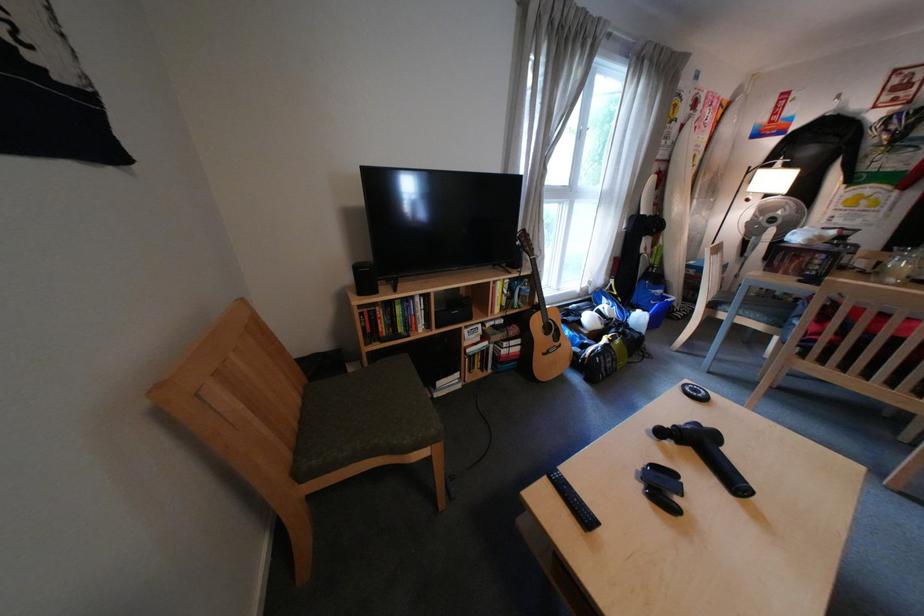
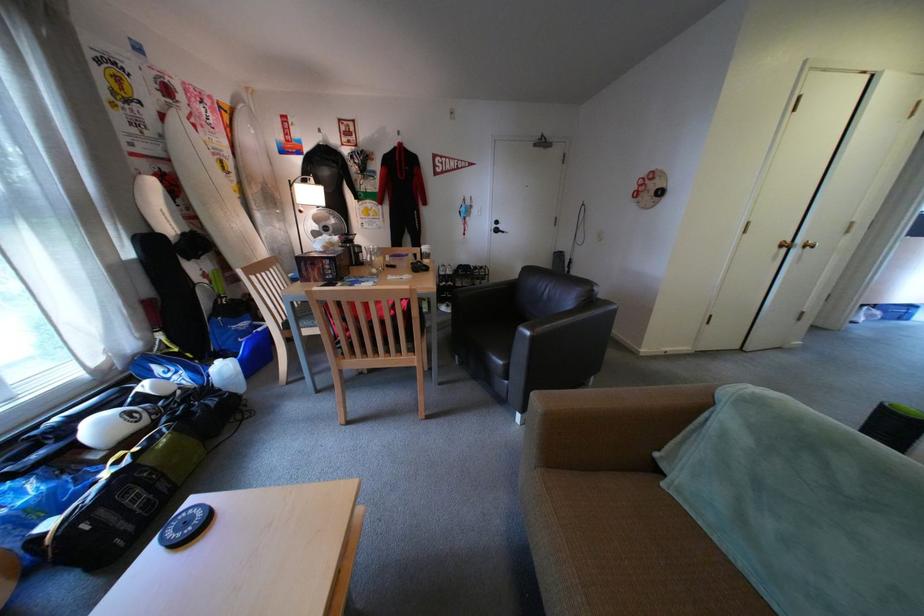
In the second image, find the point that corresponds to point (652, 312) in the first image.

(233, 363)